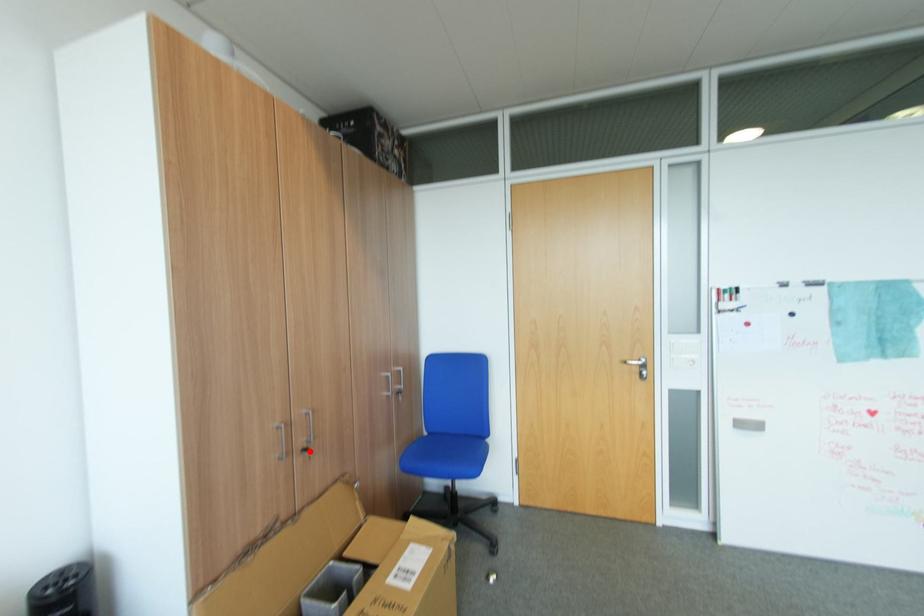
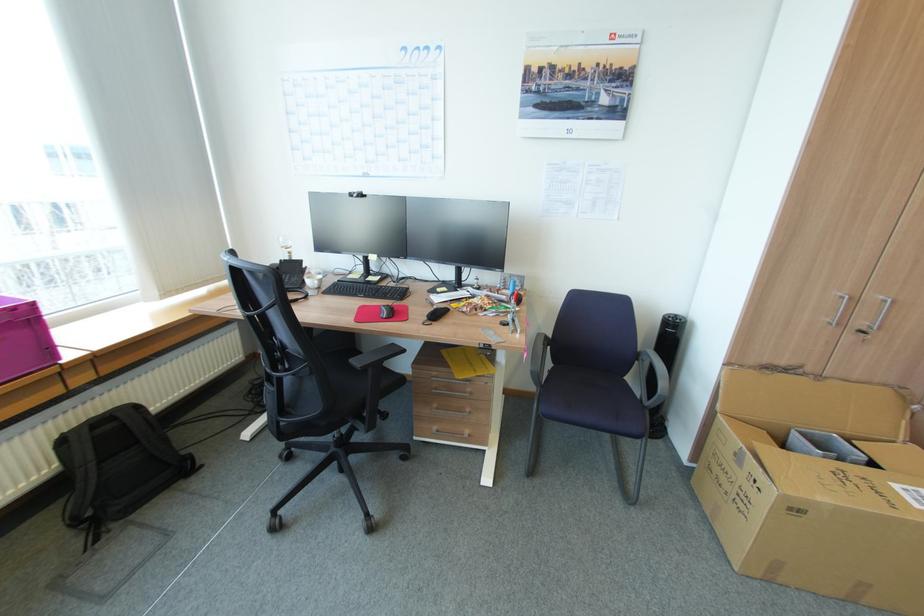
Find the pixel in the second image that matches the highlighted location in the first image.

(868, 331)